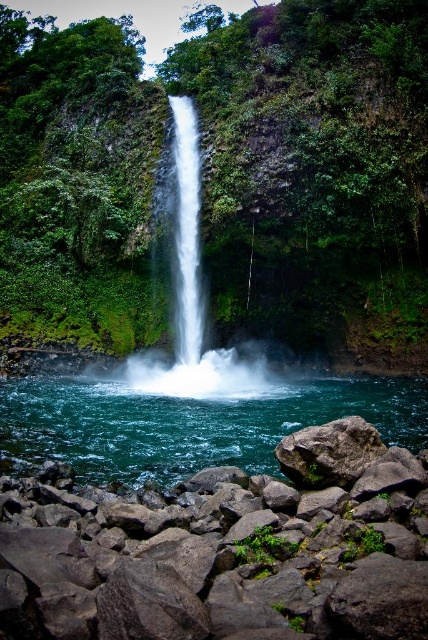
You are a hiker who wants to cross the rocky shoreline to reach the waterfall. You have a small backpack with you. The gray rough rock at center is a good stepping stone. However, you notice the clear blue water at center is in your path. Which object should you step on to avoid getting your backpack wet?

You should step on the gray rough rock at center because it is smaller than the clear blue water at center, providing a stable surface to cross without getting your backpack wet.

You are standing at the edge of the waterfall and want to place a small decorative rock at each of the two points labeled point [151,396] and point [281,452]. Which point is closer to you so the rock there will be more visible to visitors approaching from the front?

Point [151,396] is closer to you, so the rock placed there will be more visible to visitors approaching from the front.